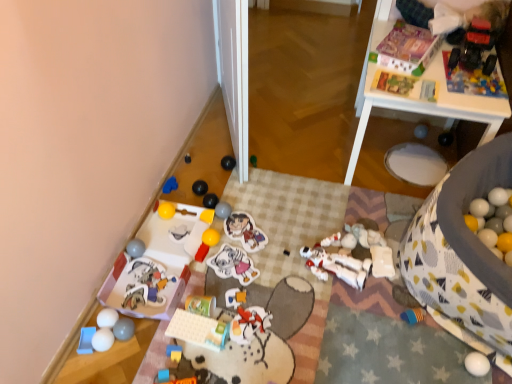
Where is `vacant area that lies between rubber yellow block at lower center, the sixteenth toy when ordered from right to left, and white matte plush at center, which ranks as the fourth toy in right-to-left order`? The image size is (512, 384). vacant area that lies between rubber yellow block at lower center, the sixteenth toy when ordered from right to left, and white matte plush at center, which ranks as the fourth toy in right-to-left order is located at coordinates (272, 314).